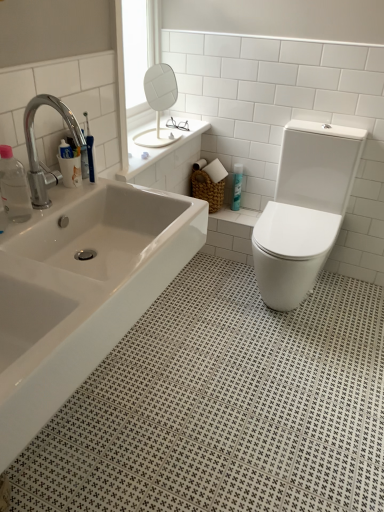
Question: Is chrome metallic faucet at upper left bigger or smaller than white glossy bathtub at center?

Choices:
 (A) small
 (B) big

Answer: (A)

Question: Which is correct: chrome metallic faucet at upper left is inside white glossy bathtub at center, or outside of it?

Choices:
 (A) outside
 (B) inside

Answer: (A)

Question: Estimate the real-world distances between objects in this image. Which object is farther from the white glossy toilet at right?

Choices:
 (A) white glossy mirror at upper center
 (B) white glossy bathtub at center
 (C) transparent plastic bottle at left, the second toiletry positioned from the top
 (D) chrome metallic faucet at upper left
 (E) blue glossy spray can at center, marked as the first toiletry in a top-to-bottom arrangement

Answer: (C)

Question: Which object is the farthest from the white glossy bathtub at center?

Choices:
 (A) blue glossy spray can at center, marked as the first toiletry in a top-to-bottom arrangement
 (B) chrome metallic faucet at upper left
 (C) white glossy toilet at right
 (D) white glossy mirror at upper center
 (E) transparent plastic bottle at left, which is the first toiletry in left-to-right order

Answer: (D)